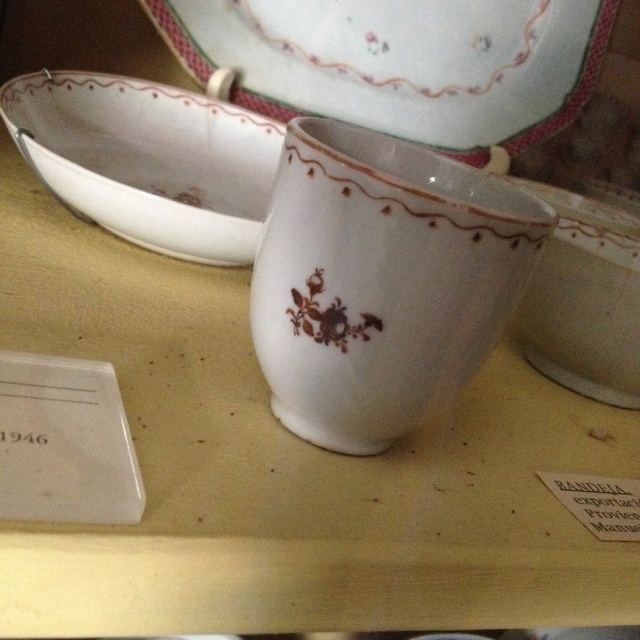
Question: Which object is closer to the camera taking this photo?

Choices:
 (A) white porcelain cup at center
 (B) white porcelain bowl at center
 (C) white porcelain plate at upper center
 (D) white porcelain bowl at upper left

Answer: (A)

Question: Is white porcelain plate at upper center below white porcelain bowl at center?

Choices:
 (A) yes
 (B) no

Answer: (B)

Question: Does white porcelain cup at center appear under white porcelain bowl at center?

Choices:
 (A) yes
 (B) no

Answer: (A)

Question: Which point is closer to the camera taking this photo?

Choices:
 (A) (76, 108)
 (B) (412, 232)
 (C) (602, 301)

Answer: (B)

Question: Does white porcelain plate at upper center have a lesser width compared to white porcelain bowl at center?

Choices:
 (A) yes
 (B) no

Answer: (B)

Question: Estimate the real-world distances between objects in this image. Which object is farther from the white porcelain bowl at center?

Choices:
 (A) white porcelain bowl at upper left
 (B) white porcelain cup at center
 (C) white porcelain plate at upper center

Answer: (A)